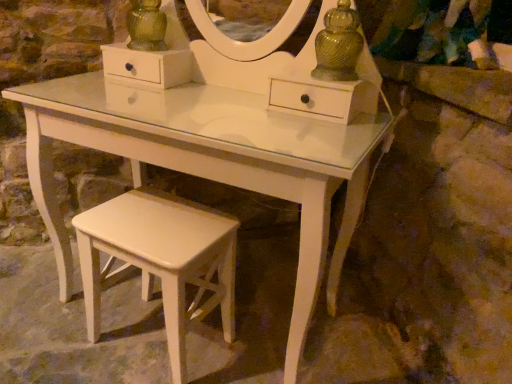
I want to click on free space above white painted wood stool at lower left (from a real-world perspective), so click(154, 223).